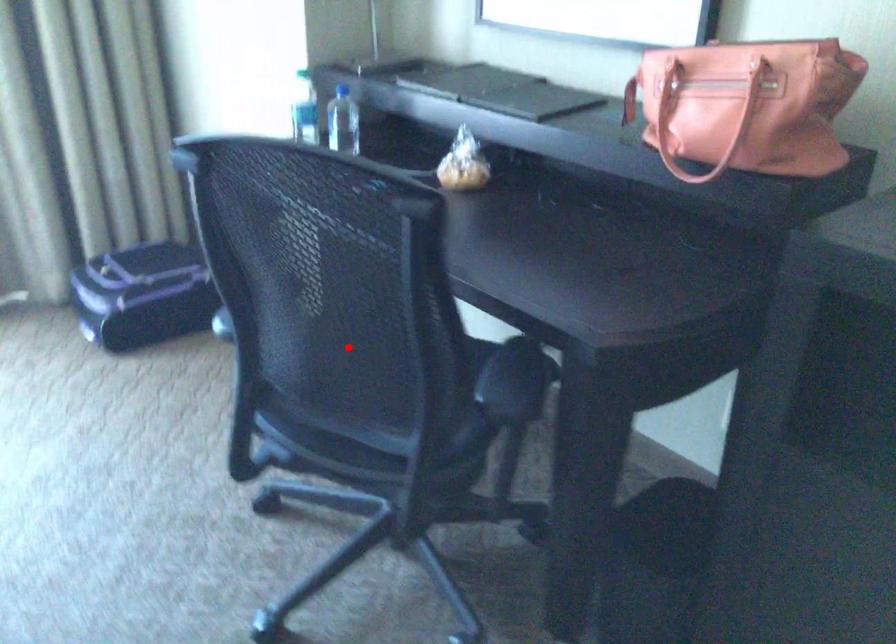
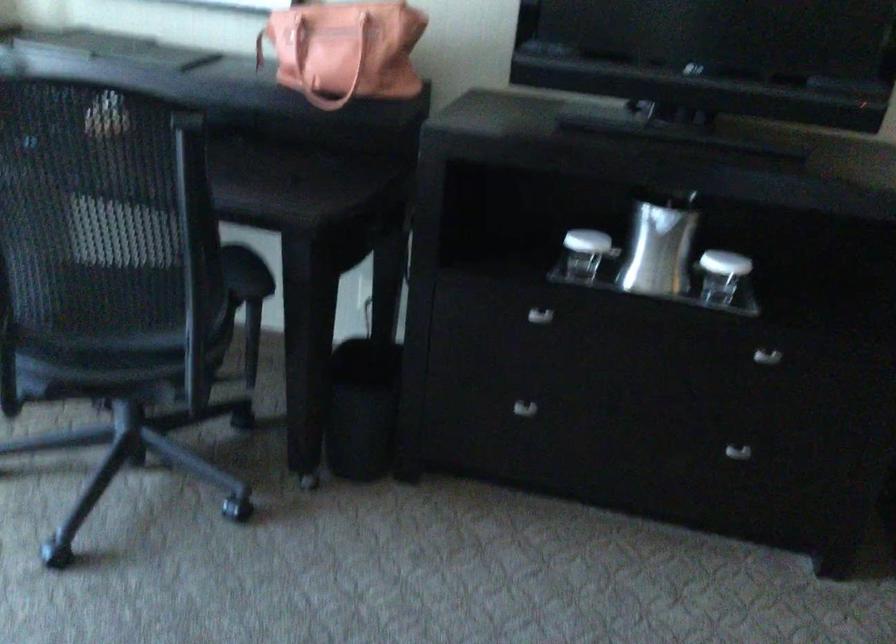
Locate, in the second image, the point that corresponds to the highlighted location in the first image.

(107, 265)